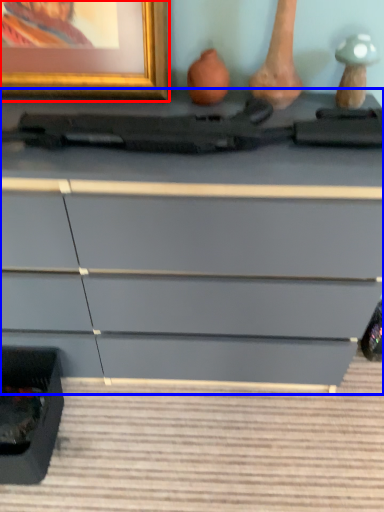
Question: Which point is further to the camera, picture frame (highlighted by a red box) or chest of drawers (highlighted by a blue box)?

Choices:
 (A) picture frame
 (B) chest of drawers

Answer: (A)